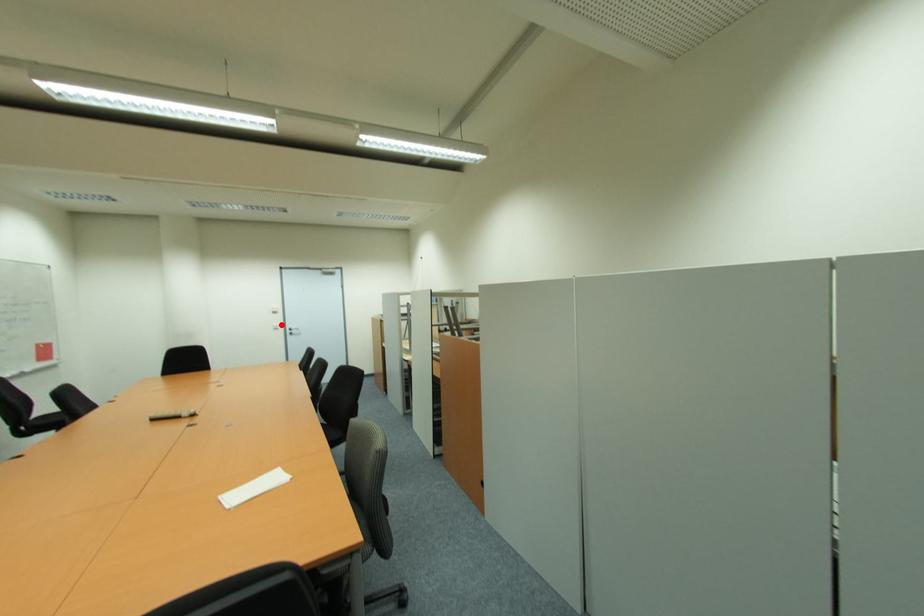
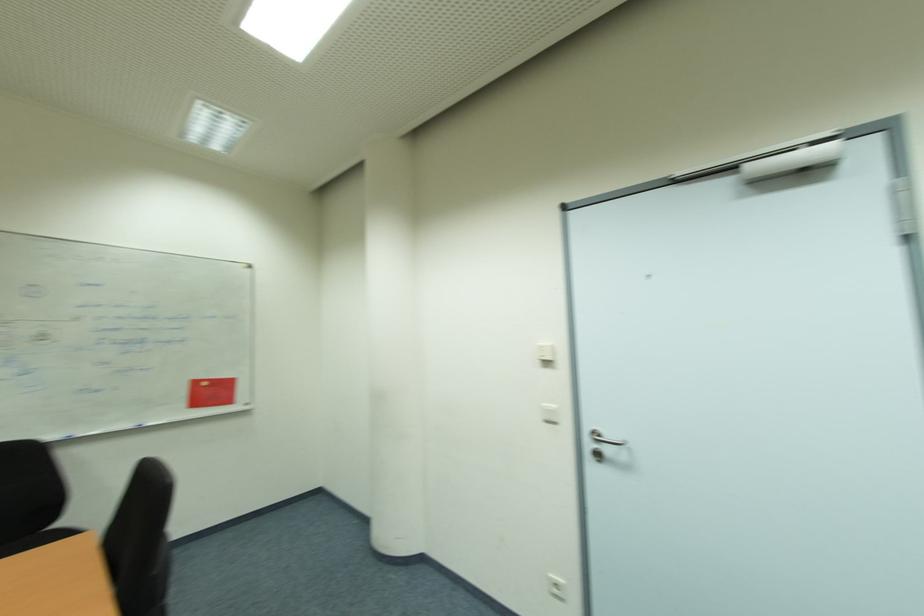
Find the pixel in the second image that matches the highlighted location in the first image.

(556, 407)